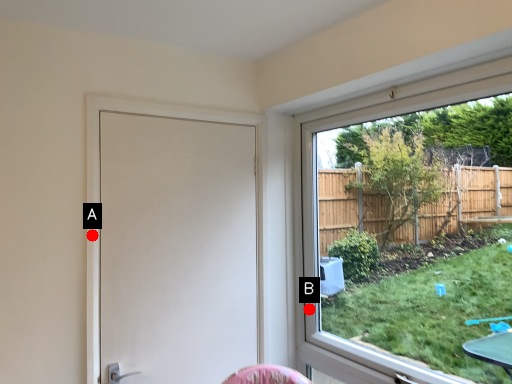
Question: Two points are circled on the image, labeled by A and B beside each circle. Which point is closer to the camera?

Choices:
 (A) A is closer
 (B) B is closer

Answer: (A)